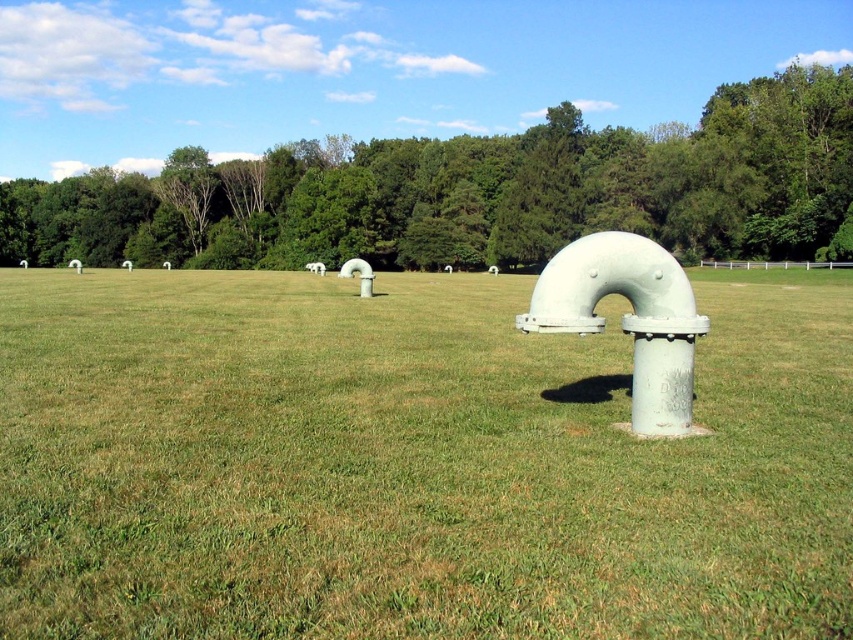
Question: Is green grassy at center to the left of green leafy tree at center from the viewer's perspective?

Choices:
 (A) yes
 (B) no

Answer: (B)

Question: Which object appears closest to the camera in this image?

Choices:
 (A) green grassy at center
 (B) green leafy tree at center

Answer: (A)

Question: Which object appears farthest from the camera in this image?

Choices:
 (A) green leafy tree at center
 (B) green grassy at center

Answer: (A)

Question: Is green grassy at center wider than green leafy tree at center?

Choices:
 (A) no
 (B) yes

Answer: (A)

Question: Among these objects, which one is nearest to the camera?

Choices:
 (A) green grassy at center
 (B) green leafy tree at center

Answer: (A)

Question: Is green grassy at center wider than green leafy tree at center?

Choices:
 (A) no
 (B) yes

Answer: (A)